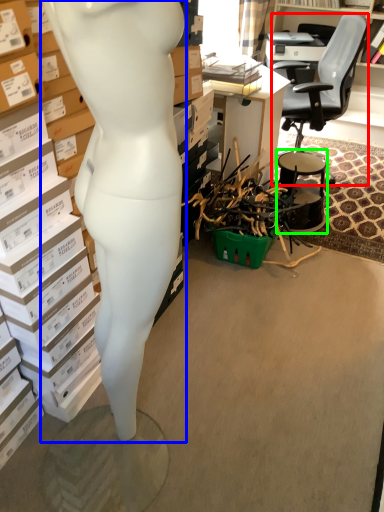
Question: Estimate the real-world distances between objects in this image. Which object is closer to chair (highlighted by a red box), person (highlighted by a blue box) or drum (highlighted by a green box)?

Choices:
 (A) person
 (B) drum

Answer: (B)